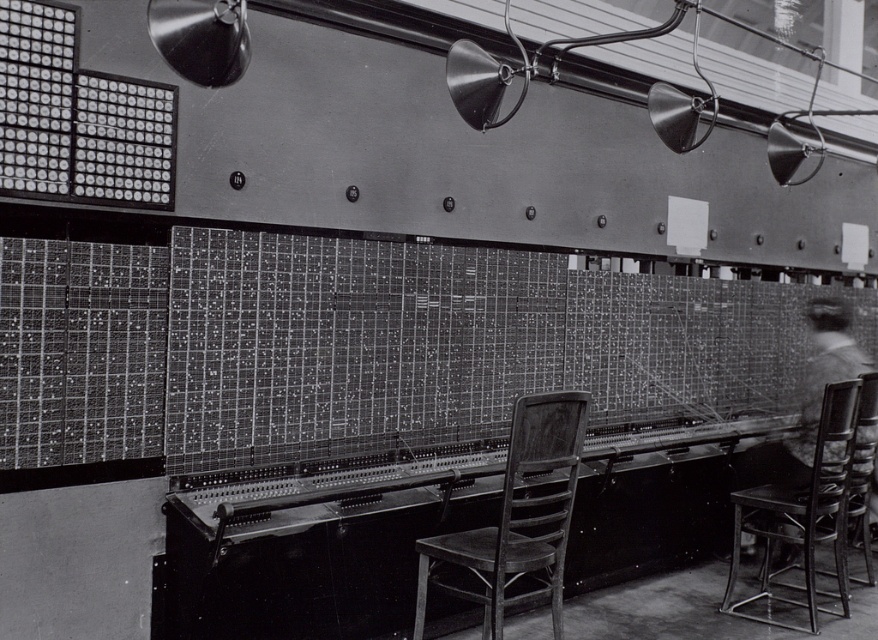
You are an operator in the control room and need to sit in one of the chairs to monitor the panel. Which chair, the wooden chair at center or the wooden chair at right, would allow you to reach the console below the panel more easily?

The wooden chair at right is larger, so it might have a higher seat, allowing better reach to the console below the panel. Therefore, the wooden chair at right would allow you to reach the console more easily.